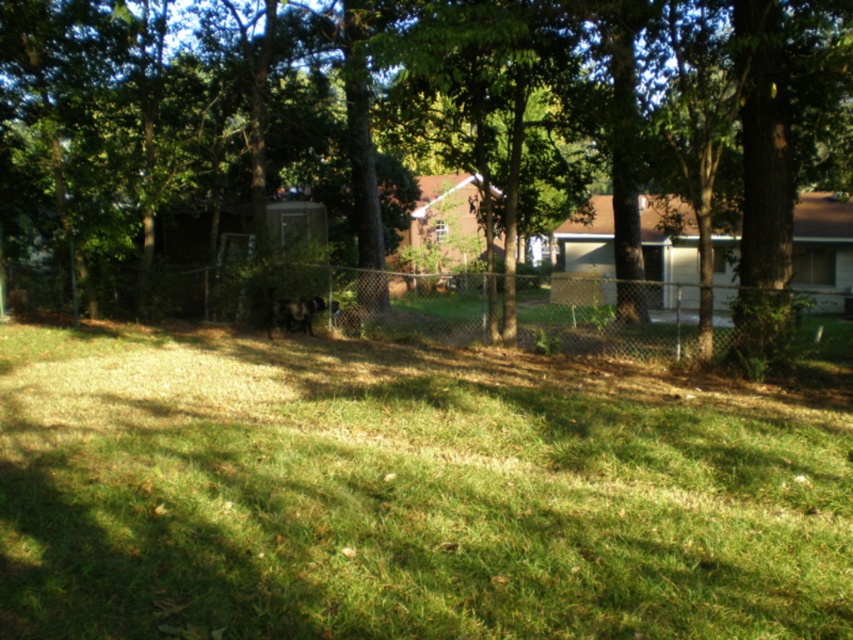
Who is positioned more to the right, green grassy at center or green leafy tree at center?

Positioned to the right is green leafy tree at center.

Measure the distance between point (183,545) and camera.

Point (183,545) and camera are 15.10 feet apart.

This screenshot has width=853, height=640. What are the coordinates of `green grassy at center` in the screenshot? It's located at (405, 493).